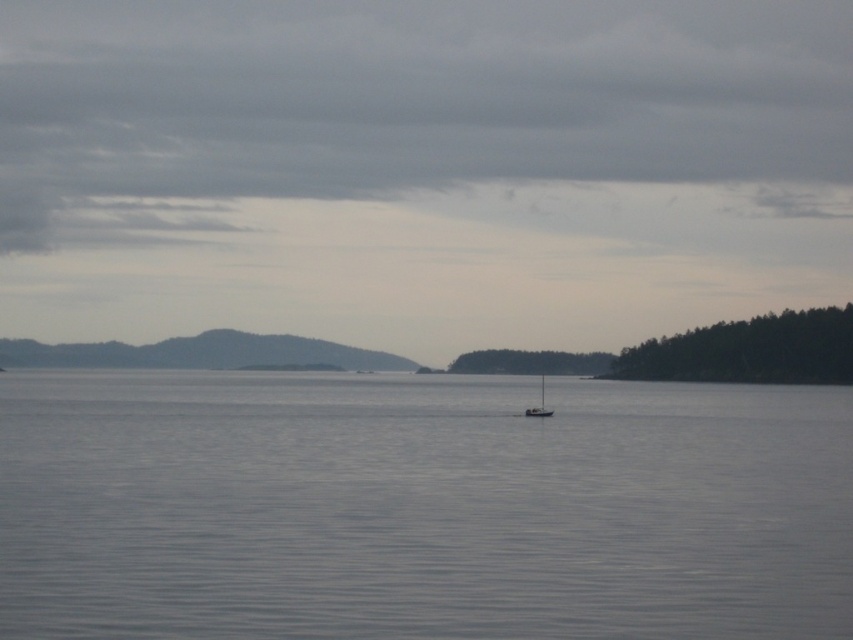
Is point (88, 547) closer to viewer compared to point (538, 406)?

Yes, it is.

The height and width of the screenshot is (640, 853). I want to click on clear water at center, so click(x=421, y=508).